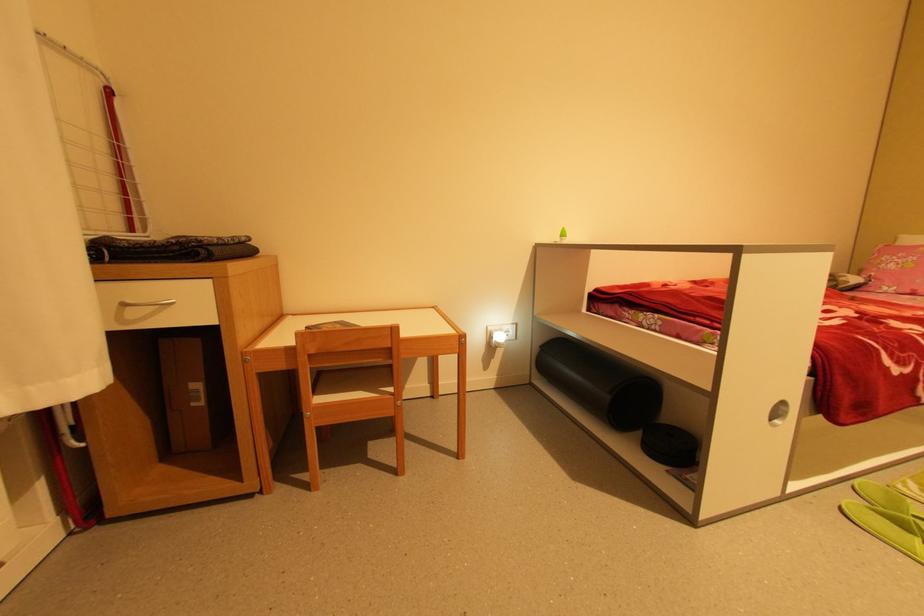
Locate an element on the screen. This screenshot has height=616, width=924. cardboard box is located at coordinates click(x=185, y=394).